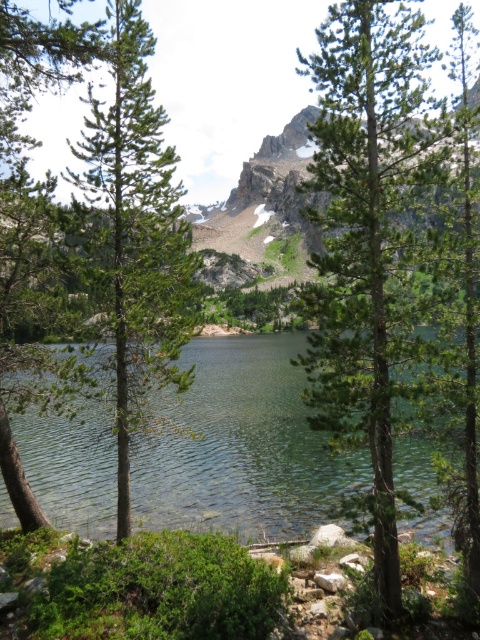
Can you confirm if clear water at center is shorter than green needle-like tree at center?

Yes.

Who is more distant from viewer, (10, 524) or (155, 182)?

Positioned behind is point (10, 524).

You are a GUI agent. You are given a task and a screenshot of the screen. Output one action in this format:
    pyautogui.click(x=<x>, y=<y>)
    Task: Click on the clear water at center
    
    Given the screenshot: What is the action you would take?
    pyautogui.click(x=239, y=445)

Can you confirm if green needle-like tree at center is wider than green matte tree at left?

Yes, green needle-like tree at center is wider than green matte tree at left.

Who is positioned more to the right, green needle-like tree at center or green matte tree at left?

green needle-like tree at center

The width and height of the screenshot is (480, 640). I want to click on green needle-like tree at center, so click(x=139, y=234).

Is green needle-like leaves at center to the left of green needle-like tree at center from the viewer's perspective?

No, green needle-like leaves at center is not to the left of green needle-like tree at center.

Can you confirm if green needle-like leaves at center is positioned to the right of green needle-like tree at center?

Correct, you'll find green needle-like leaves at center to the right of green needle-like tree at center.

Image resolution: width=480 pixels, height=640 pixels. Describe the element at coordinates (373, 243) in the screenshot. I see `green needle-like leaves at center` at that location.

This screenshot has height=640, width=480. In order to click on green needle-like leaves at center in this screenshot , I will do `click(373, 243)`.